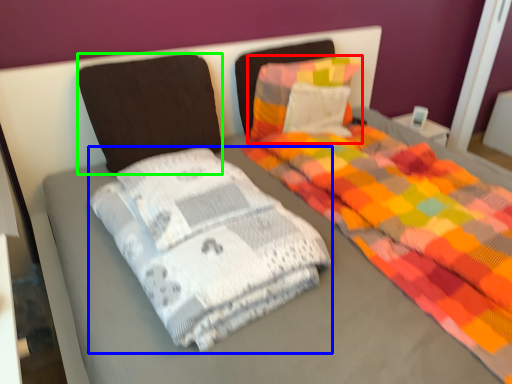
Question: Based on their relative distances, which object is nearer to pillow (highlighted by a red box)? Choose from material (highlighted by a blue box) and pillow (highlighted by a green box).

Choices:
 (A) material
 (B) pillow

Answer: (B)